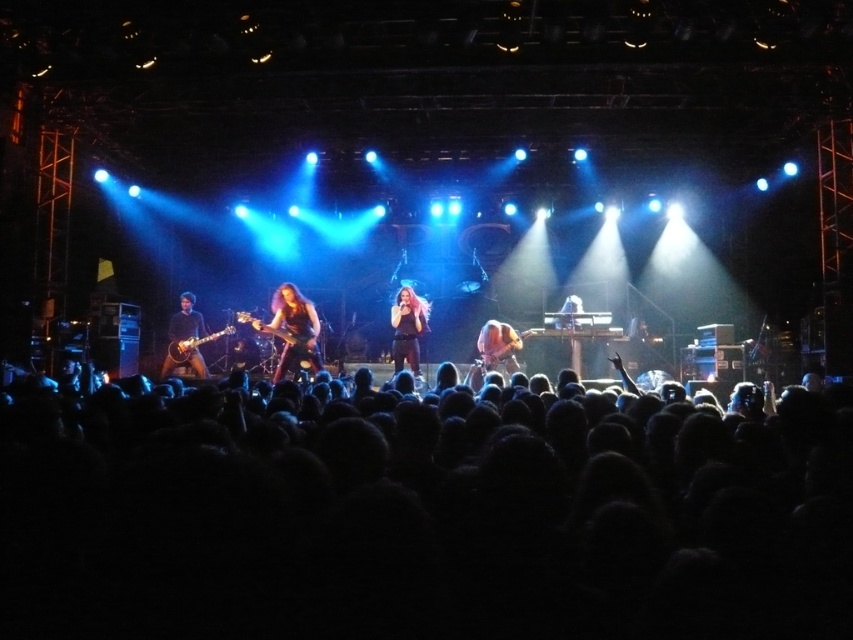
You are at a concert and want to take a photo of the shiny black guitar at center. The camera you are using has a focus point at coordinate point [293,328]. Will this focus point align with the shiny black guitar at center?

Yes, the point [293,328] corresponds to the shiny black guitar at center, so the focus point will align with it.

Consider the image. You are a stagehand who needs to move a 5.5 feet long ladder between the shiny black guitar at center and the shiny brown guitar at center. Can you fit the ladder between them without moving the guitars?

The distance between the shiny black guitar at center and the shiny brown guitar at center is 6.09 feet. Since the ladder is 5.5 feet long, it can fit between them as the space is slightly larger than the ladder.